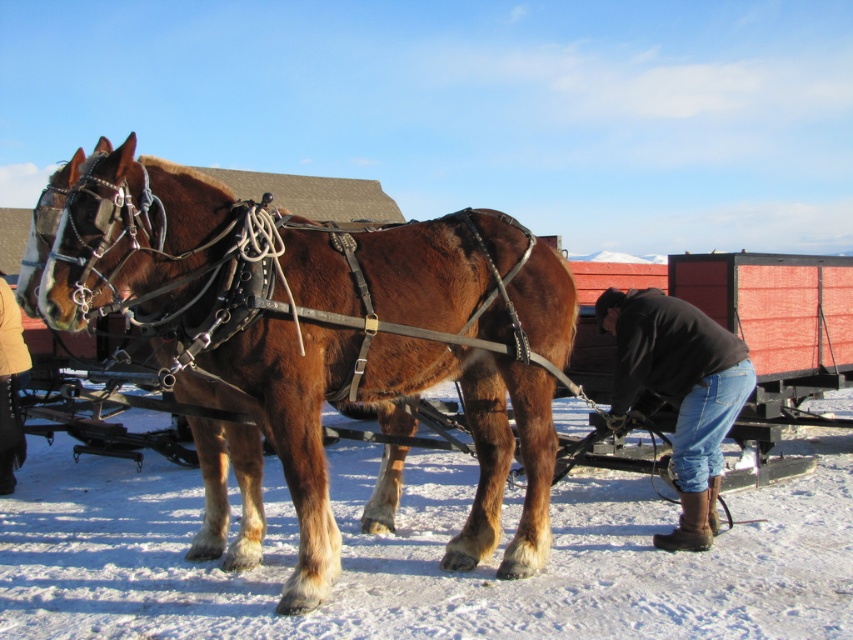
You are standing in the snowy field and want to pick up the brown leather harness at center and the black leather boots at lower right. Which object should you reach for first based on their positions?

The brown leather harness at center is closer to the viewer than the black leather boots at lower right, so you should reach for the brown leather harness at center first.

You are a farmer checking the equipment before a sleigh ride. You notice the brown leather harness at center and the yellow leather boots at lower left. Which item has a larger width?

The brown leather harness at center might be wider than yellow leather boots at lower left.

You are standing in the winter scene with two draft horses. You notice two points marked in the image. One is at coordinate point (200, 356) and the other is at point (0, 435). Which of these two points is nearer to your viewpoint?

Point (200, 356) is closer to the camera than point (0, 435).